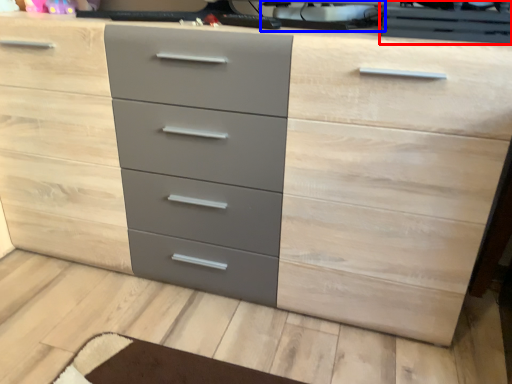
Question: Which object is closer to the camera taking this photo, desktop computer (highlighted by a red box) or desktop computer (highlighted by a blue box)?

Choices:
 (A) desktop computer
 (B) desktop computer

Answer: (A)